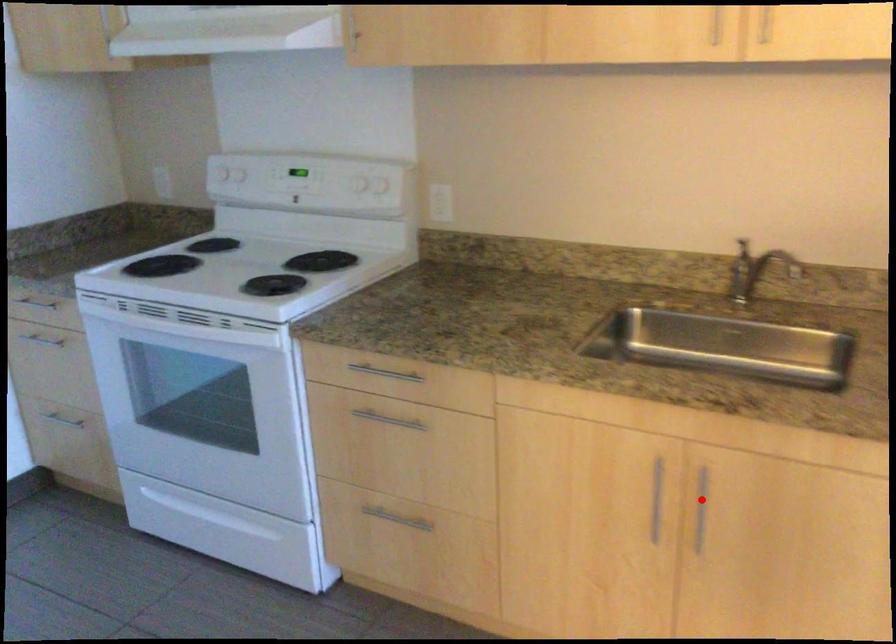
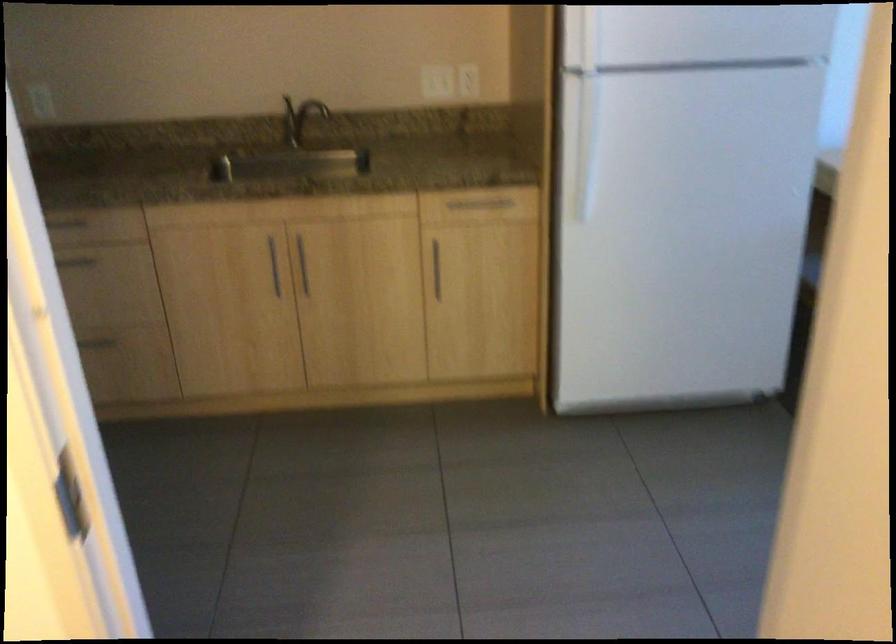
Locate, in the second image, the point that corresponds to the highlighted location in the first image.

(303, 265)